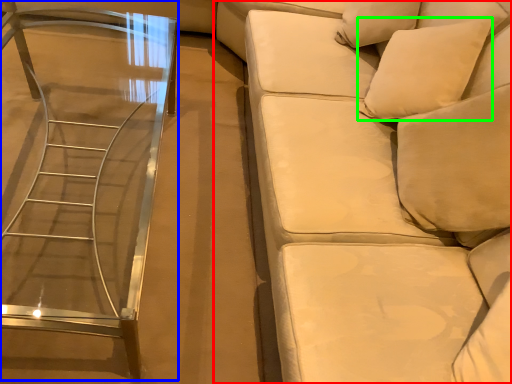
Question: Based on their relative distances, which object is nearer to studio couch (highlighted by a red box)? Choose from table (highlighted by a blue box) and pillow (highlighted by a green box).

Choices:
 (A) table
 (B) pillow

Answer: (B)